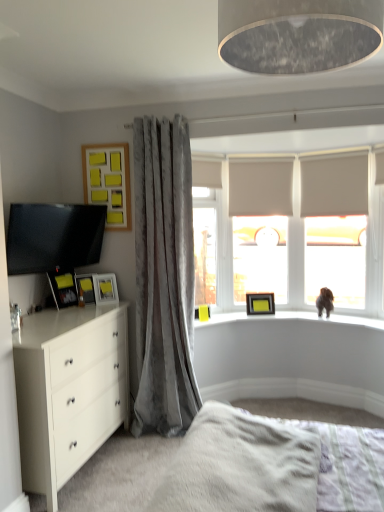
Question: Is matte black picture frame at left, which appears as the fifth picture frame when viewed from the back, closer to the viewer compared to matte black tv at left?

Choices:
 (A) yes
 (B) no

Answer: (B)

Question: From the image's perspective, would you say matte black picture frame at left, which ranks as the first picture frame in front-to-back order, is shown under matte black tv at left?

Choices:
 (A) no
 (B) yes

Answer: (B)

Question: Is matte black picture frame at left, which ranks as the first picture frame in front-to-back order, aimed at matte black tv at left?

Choices:
 (A) no
 (B) yes

Answer: (A)

Question: Is matte black picture frame at left, positioned as the 1th picture frame in left-to-right order, not near matte black tv at left?

Choices:
 (A) no
 (B) yes

Answer: (A)

Question: Is matte black picture frame at left, marked as the fourth picture frame in a bottom-to-top arrangement, shorter than matte black tv at left?

Choices:
 (A) no
 (B) yes

Answer: (B)

Question: Is matte black picture frame at left, which appears as the fifth picture frame when viewed from the back, at the right side of matte black tv at left?

Choices:
 (A) yes
 (B) no

Answer: (B)

Question: From the image's perspective, is matte yellow picture frame at upper center, which is the 5th picture frame from front to back, over white fluffy bed at lower center?

Choices:
 (A) yes
 (B) no

Answer: (A)

Question: Is matte yellow picture frame at upper center, the 1th picture frame from the bottom, taller than white fluffy bed at lower center?

Choices:
 (A) yes
 (B) no

Answer: (A)

Question: Is there a large distance between matte yellow picture frame at upper center, the 5th picture frame in the left-to-right sequence, and white fluffy bed at lower center?

Choices:
 (A) yes
 (B) no

Answer: (A)

Question: From a real-world perspective, is matte yellow picture frame at upper center, which is the first picture frame in back-to-front order, below white fluffy bed at lower center?

Choices:
 (A) no
 (B) yes

Answer: (A)

Question: Is matte yellow picture frame at upper center, the 1th picture frame from the bottom, oriented towards white fluffy bed at lower center?

Choices:
 (A) yes
 (B) no

Answer: (A)

Question: Does matte yellow picture frame at upper center, which is the first picture frame in back-to-front order, have a smaller size compared to white fluffy bed at lower center?

Choices:
 (A) no
 (B) yes

Answer: (B)

Question: Is white fluffy bed at lower center at the back of matte black tv at left?

Choices:
 (A) no
 (B) yes

Answer: (A)